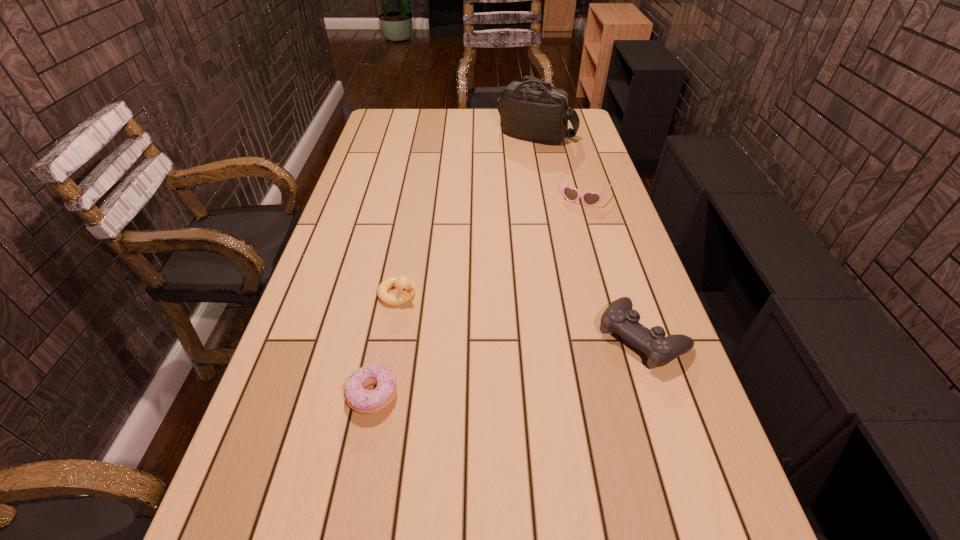
You are a GUI agent. You are given a task and a screenshot of the screen. Output one action in this format:
    pyautogui.click(x=<x>, y=<y>)
    Task: Click on the free space on the desktop that is between the doughnut and the control and is positioned on the front-facing side of the second farthest object
    This screenshot has width=960, height=540.
    Given the screenshot: What is the action you would take?
    pyautogui.click(x=504, y=367)

Where is `vacant space on the desktop that is between the doughnut and the control and is positioned at the beak of the duckling`? The width and height of the screenshot is (960, 540). vacant space on the desktop that is between the doughnut and the control and is positioned at the beak of the duckling is located at coordinates (519, 363).

This screenshot has width=960, height=540. What are the coordinates of `vacant space on the desktop that is between the doughnut and the control and is positioned at the front padded panel of the shoulder bag` in the screenshot? It's located at (479, 372).